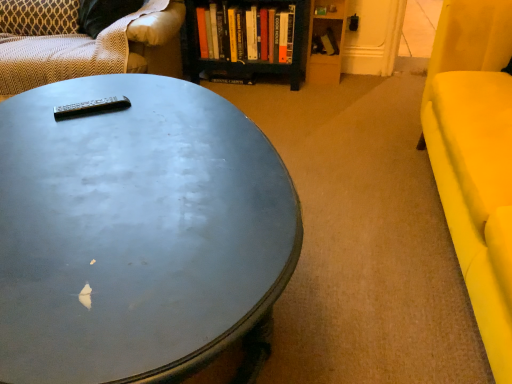
The width and height of the screenshot is (512, 384). Find the location of `unoccupied region to the right of black plastic remote at center`. unoccupied region to the right of black plastic remote at center is located at coordinates (152, 108).